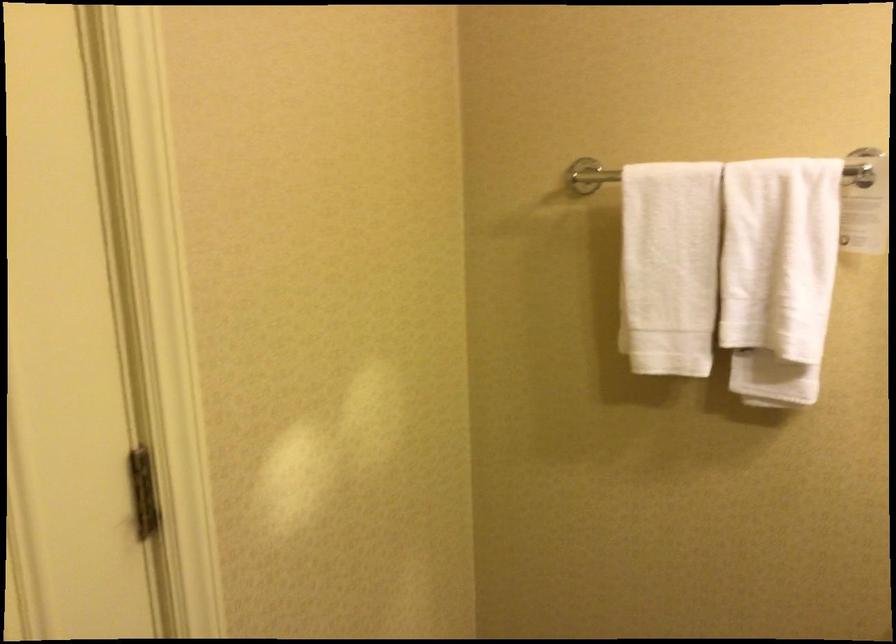
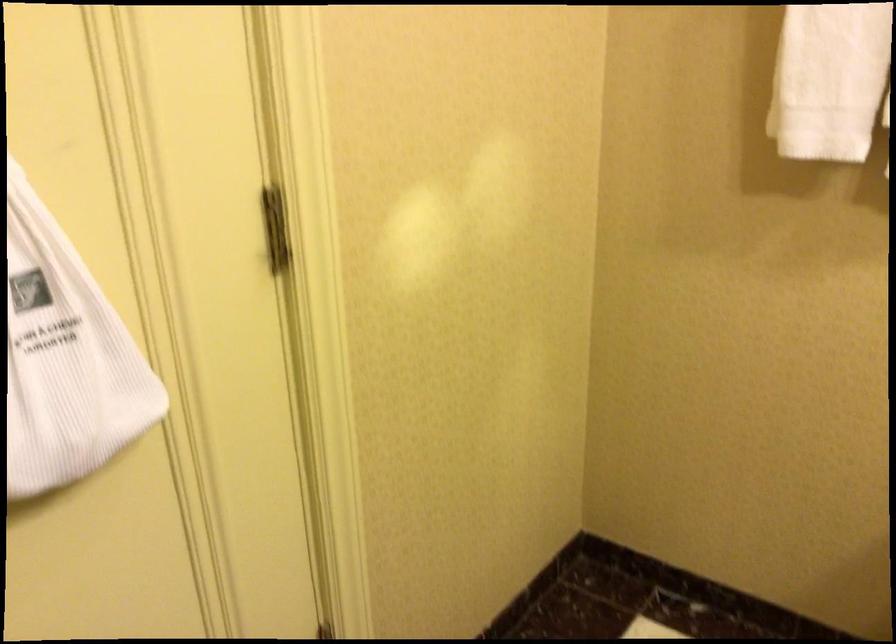
Find the pixel in the second image that matches the point at 673,310 in the first image.

(830, 80)